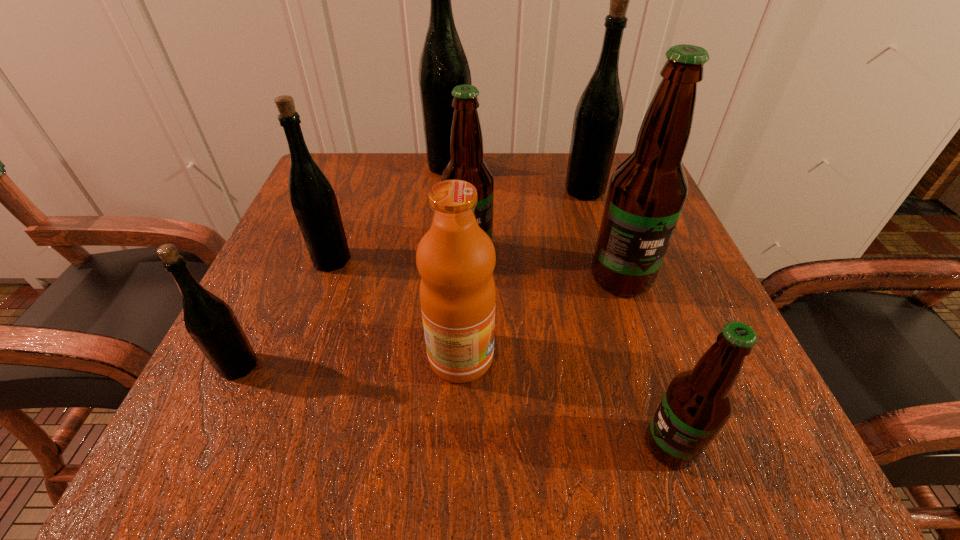
Locate an element on the screen. The width and height of the screenshot is (960, 540). the farthest green beer bottle is located at coordinates (443, 65).

In order to click on the tallest object in this screenshot , I will do `click(443, 65)`.

At what (x,y) coordinates should I click in order to perform the action: click on the second biggest green beer bottle. Please return your answer as a coordinate pair (x, y). Looking at the image, I should click on (598, 117).

Find the location of a particular element. The height and width of the screenshot is (540, 960). the second farthest object is located at coordinates (598, 117).

At what (x,y) coordinates should I click in order to perform the action: click on the biggest brown beer bottle. Please return your answer as a coordinate pair (x, y). The image size is (960, 540). Looking at the image, I should click on (647, 192).

Locate an element on the screen. the second beer bottle from left to right is located at coordinates (313, 200).

Find the location of a particular element. The height and width of the screenshot is (540, 960). the second smallest green beer bottle is located at coordinates [313, 200].

Where is `the leftmost brown beer bottle`? the leftmost brown beer bottle is located at coordinates (466, 141).

At what (x,y) coordinates should I click in order to perform the action: click on fruit juice. Please return your answer as a coordinate pair (x, y). Looking at the image, I should click on (455, 258).

Where is `the nearest green beer bottle`? the nearest green beer bottle is located at coordinates (212, 324).